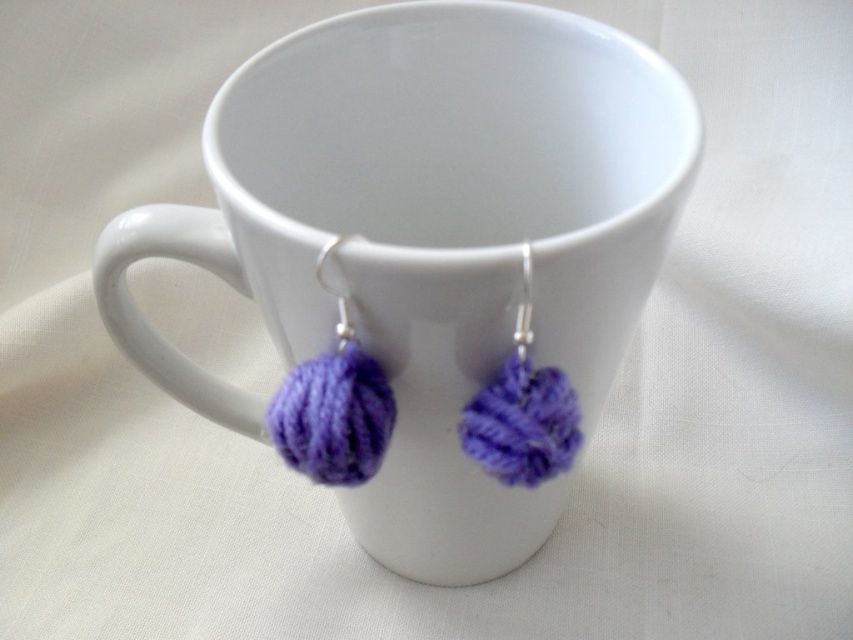
Question: Is white ceramic mug at center above purple yarn ball at center?

Choices:
 (A) yes
 (B) no

Answer: (A)

Question: Is white ceramic mug at center positioned in front of purple yarn pom-pom at left?

Choices:
 (A) no
 (B) yes

Answer: (B)

Question: Which point is closer to the camera taking this photo?

Choices:
 (A) (361, 410)
 (B) (547, 460)
 (C) (386, 365)

Answer: (B)

Question: Which of the following is the closest to the observer?

Choices:
 (A) (354, 337)
 (B) (531, 400)

Answer: (B)

Question: Among these points, which one is farthest from the camera?

Choices:
 (A) (299, 403)
 (B) (302, 314)

Answer: (B)

Question: Does white ceramic mug at center appear on the left side of purple yarn ball at center?

Choices:
 (A) yes
 (B) no

Answer: (A)